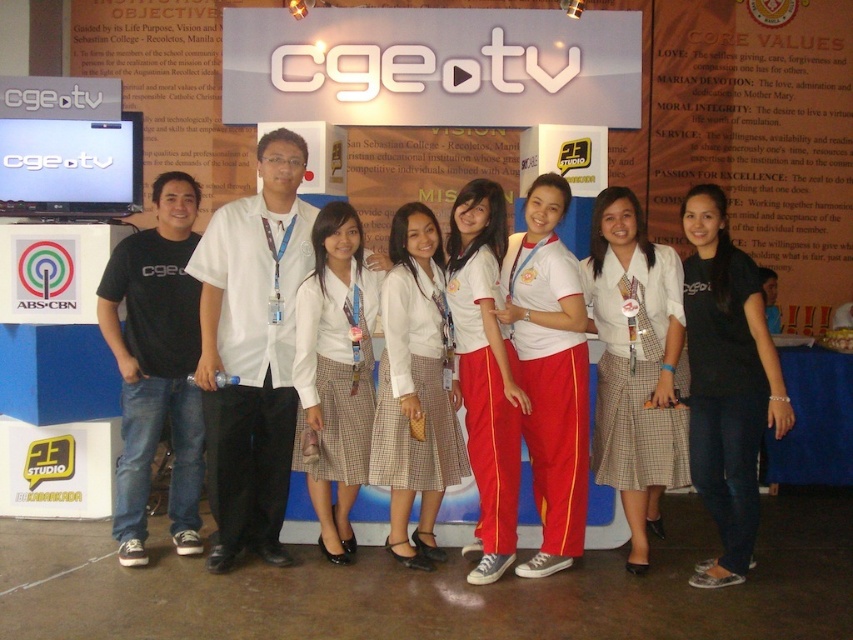
You are a photographer trying to decide which clothing item to focus on in the image. Both the white plaid skirt at center and the white cotton pants at center are visible. Which one is smaller in size?

The white plaid skirt at center is smaller than the white cotton pants at center, so you should focus on the white plaid skirt at center if you want to highlight the smaller item.

You are a photographer at the event and want to ensure the black cotton shirt at right and white cotton pants at center are visible in the photo. Which item is positioned to the right of the other?

The black cotton shirt at right is positioned on the right side of white cotton pants at center.